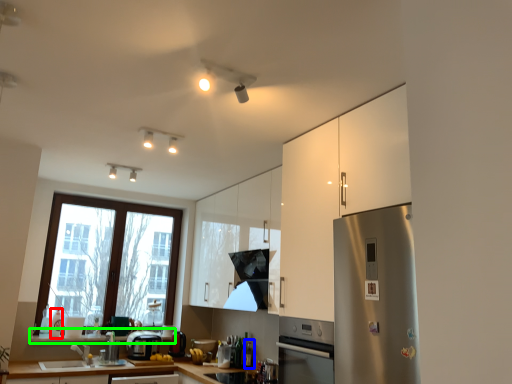
Question: Based on their relative distances, which object is farther from bottle (highlighted by a red box)? Choose from bottle (highlighted by a blue box) and window sill (highlighted by a green box).

Choices:
 (A) bottle
 (B) window sill

Answer: (A)